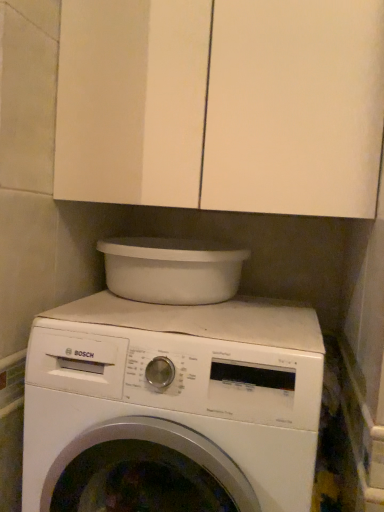
The width and height of the screenshot is (384, 512). Identify the location of vacant area that lies in front of white plastic basin at upper center. (181, 317).